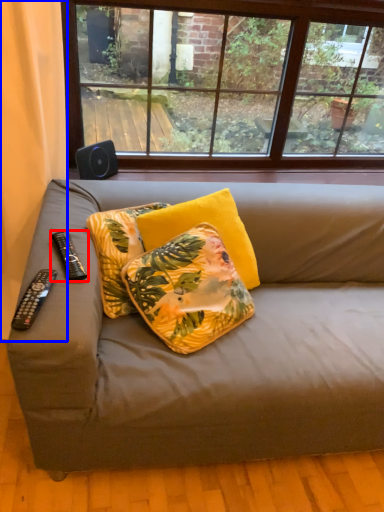
Question: Which point is further to the camera, remote control (highlighted by a red box) or curtain (highlighted by a blue box)?

Choices:
 (A) remote control
 (B) curtain

Answer: (A)